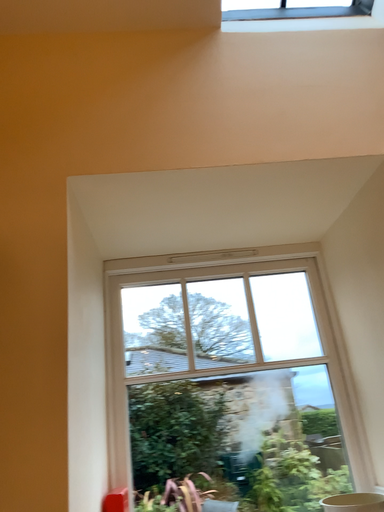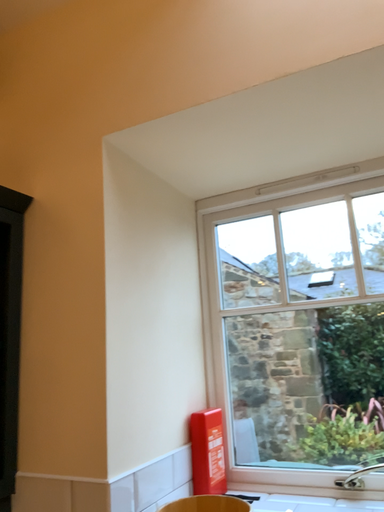
Question: Which way did the camera rotate in the video?

Choices:
 (A) rotated upward
 (B) rotated downward

Answer: (B)